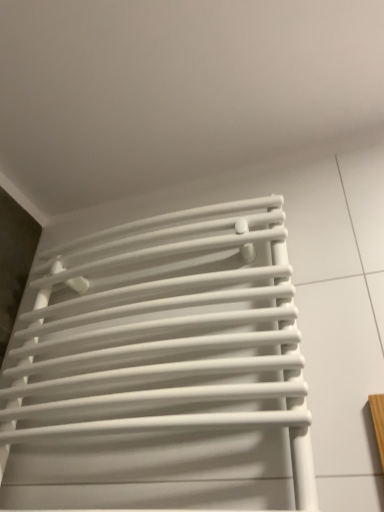
Measure the distance between point (45, 361) and camera.

The distance of point (45, 361) from camera is 35.12 inches.

Identify the location of white matte radiator at center. (161, 370).

Describe the element at coordinates (161, 370) in the screenshot. The height and width of the screenshot is (512, 384). I see `white matte radiator at center` at that location.

I want to click on white matte radiator at center, so click(x=161, y=370).